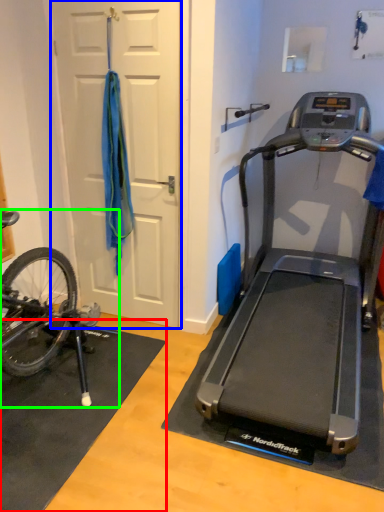
Question: Which is nearer to the doormat (highlighted by a red box)? door (highlighted by a blue box) or mountain bike (highlighted by a green box).

Choices:
 (A) door
 (B) mountain bike

Answer: (B)